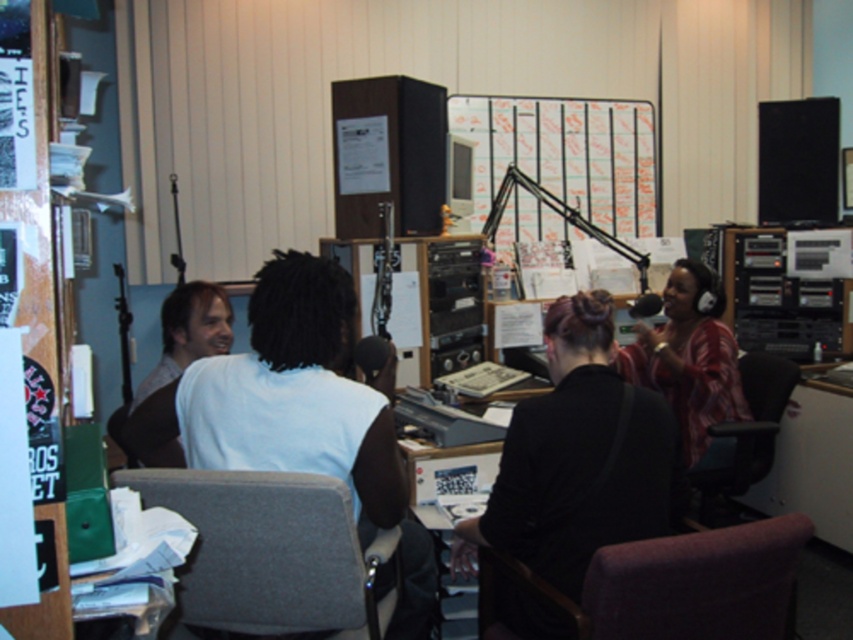
You are a sound engineer in the studio and need to adjust the microphone stand located at point [270,552]. However, you notice that the microphone stand is currently occupied by a gray fabric swivel chair at center. To access the microphone stand, you need to move the gray fabric swivel chair at center. Where should you move it to so it doesn

The gray fabric swivel chair at center is located at point [270,552]. To move it, you could relocate it to an adjacent area near the wall or another open space within the studio to access the microphone stand.

You are a guest entering the studio and want to sit in the purple fabric swivel chair at lower right. However, there is a person in the plaid fabric shirt at right blocking your path. Can you easily move around them to reach the chair?

The purple fabric swivel chair at lower right is smaller than the plaid fabric shirt at right, so the plaid fabric shirt at right might be closer to you, making it harder to move around them to reach the chair.

Based on the photo, in the radio station studio, there are two chairs visible in the scene. The gray fabric swivel chair at center and the purple fabric swivel chair at lower right. Which chair is positioned to the left of the other?

The gray fabric swivel chair at center is to the left of the purple fabric swivel chair at lower right.